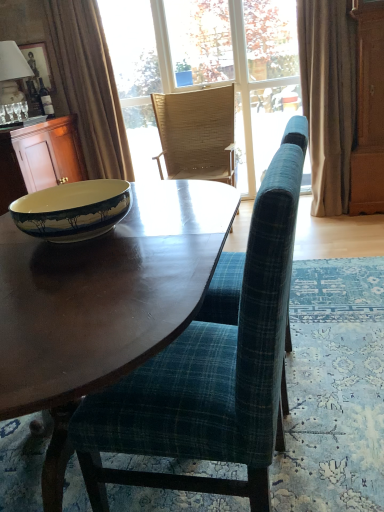
Find the location of `vacant space positioned to the left of wooden screen door at right`. vacant space positioned to the left of wooden screen door at right is located at coordinates (332, 221).